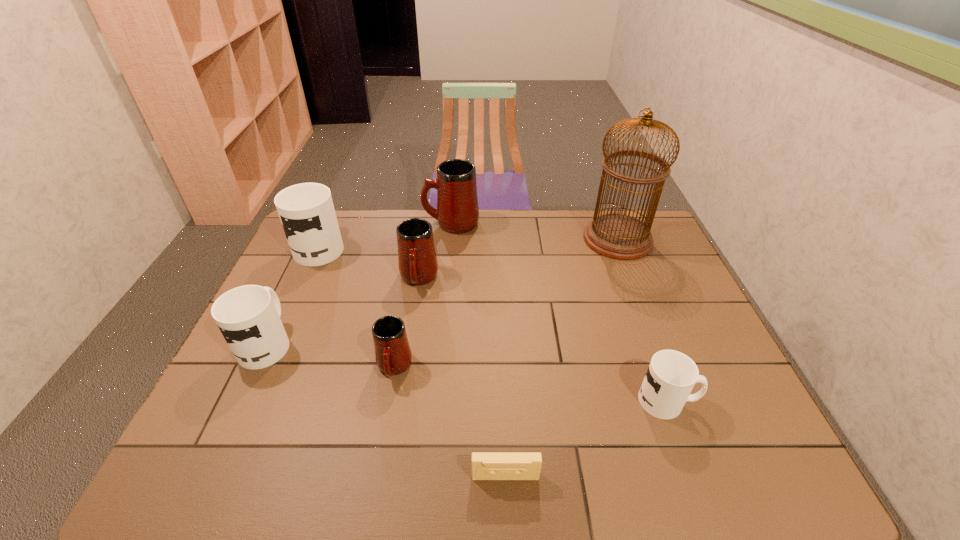
This screenshot has width=960, height=540. In order to click on vacant space located 0.090m on the side of the smallest red mug with the handle in this screenshot , I will do `click(384, 421)`.

You are a GUI agent. You are given a task and a screenshot of the screen. Output one action in this format:
    pyautogui.click(x=<x>, y=<y>)
    Task: Click on the vacant space located 0.090m on the handle side of the rightmost white mug
    The height and width of the screenshot is (540, 960).
    Given the screenshot: What is the action you would take?
    pyautogui.click(x=733, y=401)

Locate an element on the screen. birdcage that is at the far edge is located at coordinates (617, 236).

The width and height of the screenshot is (960, 540). Find the location of `object that is at the near edge`. object that is at the near edge is located at coordinates (485, 465).

Locate an element on the screen. This screenshot has width=960, height=540. birdcage that is at the right edge is located at coordinates (617, 236).

You are a GUI agent. You are given a task and a screenshot of the screen. Output one action in this format:
    pyautogui.click(x=<x>, y=<y>)
    Task: Click on the mug located in the right edge section of the desktop
    The height and width of the screenshot is (540, 960).
    Given the screenshot: What is the action you would take?
    pyautogui.click(x=671, y=375)

The height and width of the screenshot is (540, 960). I want to click on object that is at the far left corner, so click(x=306, y=210).

You are a GUI agent. You are given a task and a screenshot of the screen. Output one action in this format:
    pyautogui.click(x=<x>, y=<y>)
    Task: Click on the object located at the far right corner
    
    Given the screenshot: What is the action you would take?
    pyautogui.click(x=617, y=236)

The width and height of the screenshot is (960, 540). I want to click on vacant space at the far edge of the desktop, so click(x=377, y=233).

Locate an element on the screen. vacant space at the near edge is located at coordinates (469, 472).